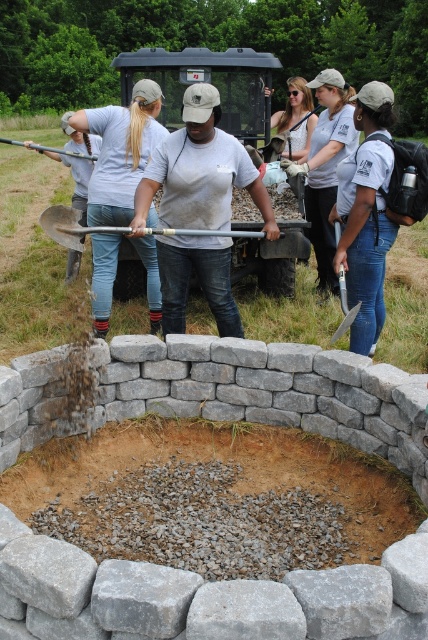
Is white cotton shirt at center closer to the viewer compared to white lace dress at center?

Yes.

Between point (330, 86) and point (297, 81), which one is positioned in front?

Point (330, 86)

Between point (324, 257) and point (287, 125), which one is positioned in front?

Positioned in front is point (324, 257).

The image size is (428, 640). Identify the location of white cotton shirt at center. (326, 166).

Based on the photo, who is positioned more to the right, denim jeans at center or white lace dress at center?

From the viewer's perspective, white lace dress at center appears more on the right side.

Can you confirm if denim jeans at center is positioned above white lace dress at center?

Incorrect, denim jeans at center is not positioned above white lace dress at center.

Which is in front, point (104, 243) or point (275, 116)?

Point (104, 243) is more forward.

You are a GUI agent. You are given a task and a screenshot of the screen. Output one action in this format:
    pyautogui.click(x=<x>, y=<y>)
    Task: Click on the denim jeans at center
    The image size is (428, 640).
    Given the screenshot: What is the action you would take?
    pyautogui.click(x=121, y=150)

Does point (107, 221) lie in front of point (311, 81)?

Yes.

Is denim jeans at center bigger than white cotton shirt at center?

Yes, denim jeans at center is bigger than white cotton shirt at center.

Between point (98, 259) and point (326, 256), which one is positioned behind?

The point (326, 256) is more distant.

Identify the location of denim jeans at center. This screenshot has width=428, height=640. coord(121,150).